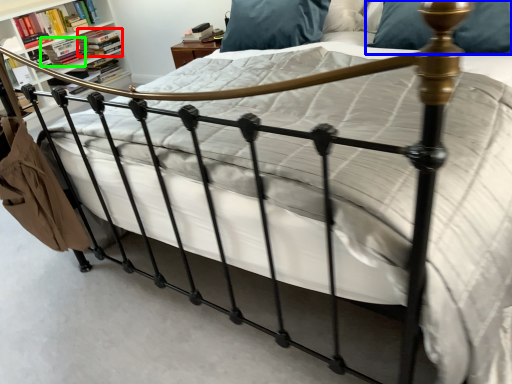
Question: Which is nearer to the book (highlighted by a red box)? pillow (highlighted by a blue box) or book (highlighted by a green box).

Choices:
 (A) pillow
 (B) book

Answer: (B)